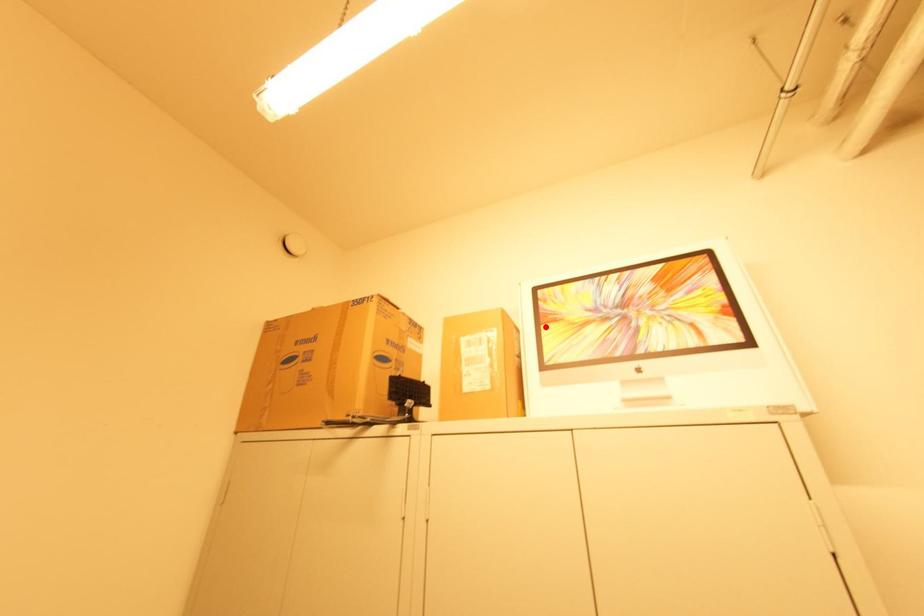
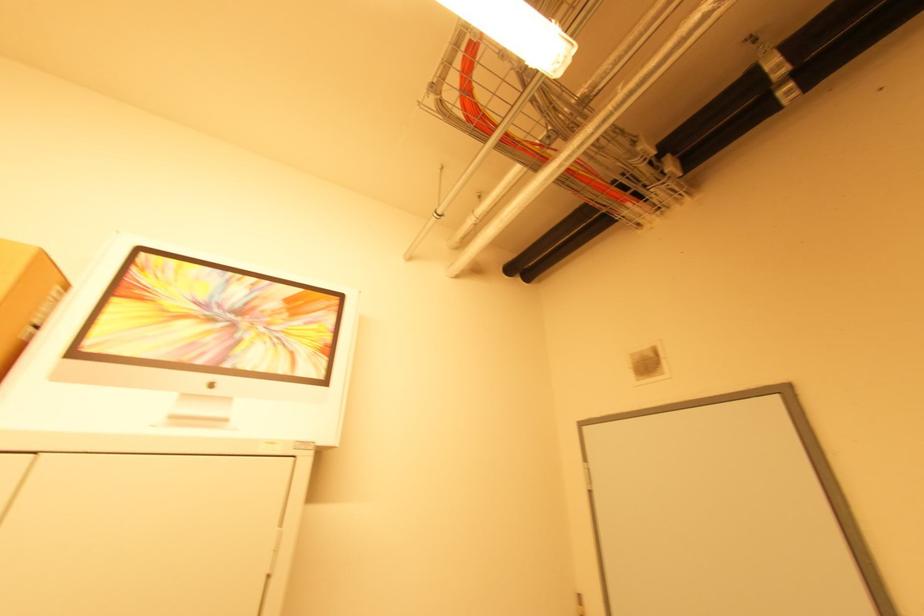
In the second image, find the point that corresponds to the highlighted location in the first image.

(117, 300)